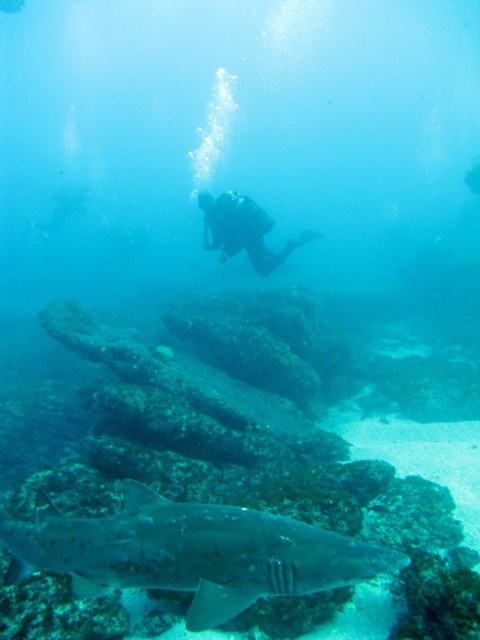
You are a marine biologist observing the underwater scene. You notice the gray textured shark at lower center and the black rubber scuba diver at center. From your vantage point, which object is closer to you?

The gray textured shark at lower center is closer to you because it is in front of the black rubber scuba diver at center.

You are a marine biologist observing the underwater scene. You need to determine if the gray textured shark at lower center and the black rubber scuba diver at center are within a safe distance of 25 feet as recommended by diving safety guidelines. Can you confirm this?

The gray textured shark at lower center and the black rubber scuba diver at center are 23.10 feet apart, which is within the recommended 25 feet safety distance according to diving guidelines.

You are a marine biologist observing this underwater scene. You notice two points marked in the image. Which of the two points, point (x=75, y=556) or point (x=220, y=198), is closer to the camera?

Point (x=75, y=556) is closer to the camera than point (x=220, y=198).